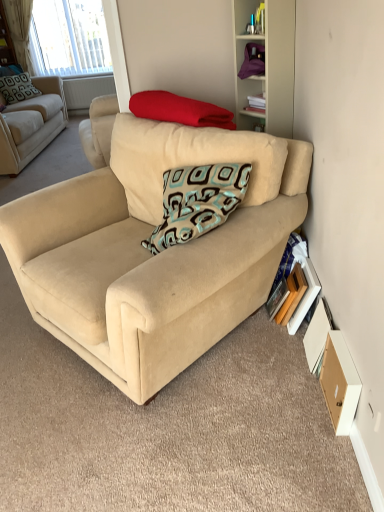
Question: Is wooden drawer at lower right smaller than teal-patterned fabric pillow at upper left, which is the first pillow in back-to-front order?

Choices:
 (A) no
 (B) yes

Answer: (B)

Question: Is wooden drawer at lower right taller than teal-patterned fabric pillow at upper left, acting as the 2th pillow starting from the right?

Choices:
 (A) no
 (B) yes

Answer: (A)

Question: Is teal-patterned fabric pillow at upper left, which is the first pillow in back-to-front order, completely or partially inside wooden drawer at lower right?

Choices:
 (A) yes
 (B) no

Answer: (B)

Question: Is teal-patterned fabric pillow at upper left, placed as the 2th pillow when sorted from bottom to top, at the back of wooden drawer at lower right?

Choices:
 (A) no
 (B) yes

Answer: (A)

Question: From the image's perspective, is wooden drawer at lower right below teal-patterned fabric pillow at upper left, placed as the 2th pillow when sorted from bottom to top?

Choices:
 (A) no
 (B) yes

Answer: (B)

Question: Is beige fabric couch at upper left, the 2th studio couch viewed from the right, bigger or smaller than wooden bookshelf at upper center, the 2th shelf when ordered from bottom to top?

Choices:
 (A) small
 (B) big

Answer: (B)

Question: Is beige fabric couch at upper left, which ranks as the first studio couch in left-to-right order, inside the boundaries of wooden bookshelf at upper center, the first shelf in the left-to-right sequence, or outside?

Choices:
 (A) inside
 (B) outside

Answer: (B)

Question: Considering the positions of beige fabric couch at upper left, the 1th studio couch when ordered from top to bottom, and wooden bookshelf at upper center, acting as the 2th shelf starting from the right, in the image, is beige fabric couch at upper left, the 1th studio couch when ordered from top to bottom, wider or thinner than wooden bookshelf at upper center, acting as the 2th shelf starting from the right,?

Choices:
 (A) thin
 (B) wide

Answer: (B)

Question: From a real-world perspective, is beige fabric couch at upper left, the 2th studio couch viewed from the right, positioned above or below wooden bookshelf at upper center, the 2th shelf when ordered from bottom to top?

Choices:
 (A) below
 (B) above

Answer: (A)

Question: In terms of height, does purple fabric at upper right, the second shelf in the left-to-right sequence, look taller or shorter compared to white matte cabinet at upper right?

Choices:
 (A) short
 (B) tall

Answer: (A)

Question: Is purple fabric at upper right, which is counted as the second shelf, starting from the back, to the left or to the right of white matte cabinet at upper right in the image?

Choices:
 (A) left
 (B) right

Answer: (A)

Question: From a real-world perspective, is purple fabric at upper right, marked as the first shelf in a front-to-back arrangement, positioned above or below white matte cabinet at upper right?

Choices:
 (A) above
 (B) below

Answer: (A)

Question: Is purple fabric at upper right, which is counted as the second shelf, starting from the back, spatially inside white matte cabinet at upper right, or outside of it?

Choices:
 (A) outside
 (B) inside

Answer: (B)

Question: From the image's perspective, relative to white matte cabinet at upper right, is hardcover book at lower right, positioned as the 2th paperback book in left-to-right order, above or below?

Choices:
 (A) below
 (B) above

Answer: (A)

Question: Based on their sizes in the image, would you say hardcover book at lower right, positioned as the 2th paperback book in left-to-right order, is bigger or smaller than white matte cabinet at upper right?

Choices:
 (A) small
 (B) big

Answer: (A)